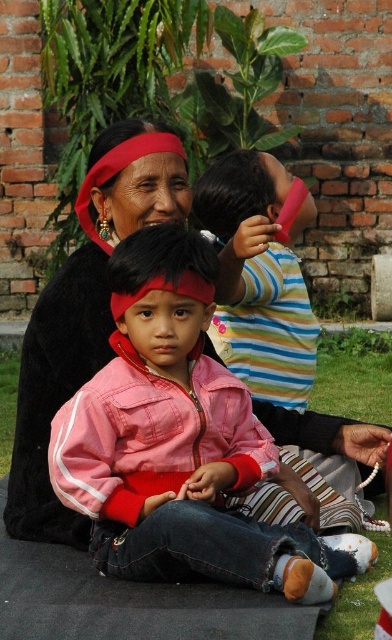
You are a photographer adjusting the camera settings to ensure both the pink fabric jacket at center and the striped cotton shirt at upper center are in focus. Which object should you adjust the focus to prioritize first based on their positions?

The pink fabric jacket at center is taller than the striped cotton shirt at upper center, so you should prioritize focusing on the pink fabric jacket at center first since it is closer to the camera.

You are a photographer trying to decide which clothing item to focus on in the image. The pink fabric jacket at center and the striped cotton shirt at upper center are both in view. Which one is bigger?

The pink fabric jacket at center is larger in size than the striped cotton shirt at upper center, so the photographer should focus on the pink fabric jacket at center since it is bigger.